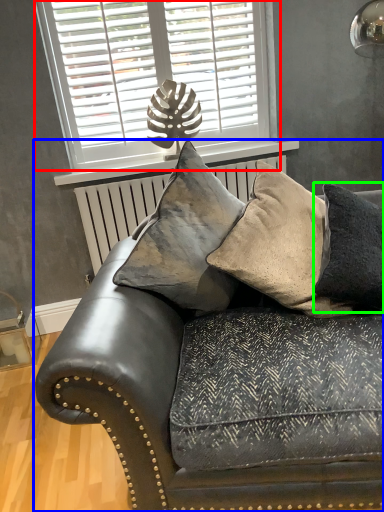
Question: Which object is positioned closest to window (highlighted by a red box)? Select from studio couch (highlighted by a blue box) and pillow (highlighted by a green box).

Choices:
 (A) studio couch
 (B) pillow

Answer: (B)